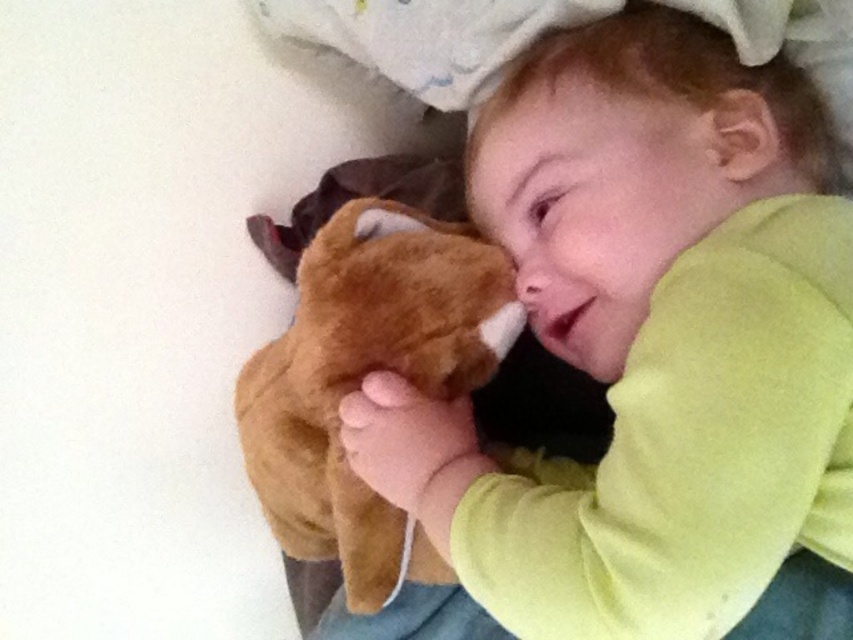
You are taking a photo of the child and their stuffed animal. You want to focus on the point closer to the camera. Which point should you choose between point (671,292) and point (497,348)?

Point (671,292) is closer to the camera than point (497,348), so you should choose point (671,292) to focus on.